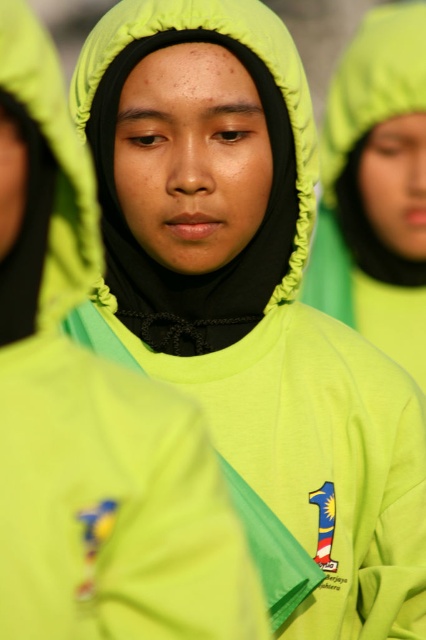
Question: Does matte green hoodie at center have a larger size compared to matte green hood at center?

Choices:
 (A) no
 (B) yes

Answer: (B)

Question: Among these objects, which one is nearest to the camera?

Choices:
 (A) matte green hood at center
 (B) neon green fabric jacket at center

Answer: (B)

Question: Does matte green hoodie at center lie behind lime green fabric hood at left?

Choices:
 (A) yes
 (B) no

Answer: (A)

Question: Which object appears farthest from the camera in this image?

Choices:
 (A) lime green fabric hood at left
 (B) matte green hoodie at center
 (C) matte green hood at center

Answer: (B)

Question: Which object appears farthest from the camera in this image?

Choices:
 (A) matte green hood at center
 (B) neon green fabric jacket at center

Answer: (A)

Question: Does matte green hoodie at center have a smaller size compared to lime green fabric hood at left?

Choices:
 (A) no
 (B) yes

Answer: (A)